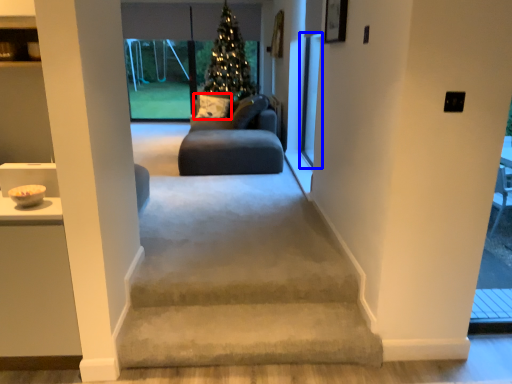
Question: Which object is closer to the camera taking this photo, pillow (highlighted by a red box) or screen door (highlighted by a blue box)?

Choices:
 (A) pillow
 (B) screen door

Answer: (B)